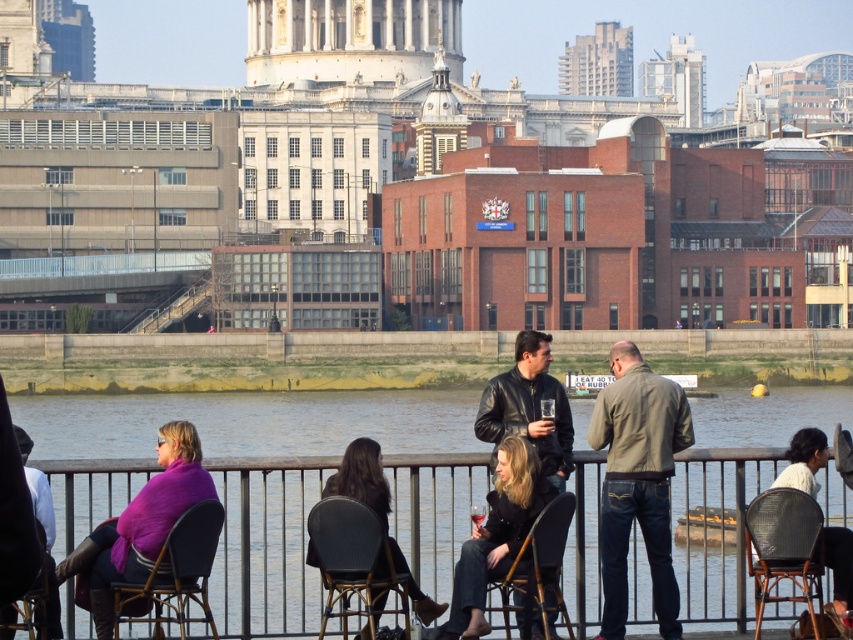
Is wooden chair at center behind dark purple sweater at lower left?

Yes.

Does wooden chair at center have a greater width compared to dark purple sweater at lower left?

In fact, wooden chair at center might be narrower than dark purple sweater at lower left.

Between point (506, 614) and point (49, 632), which one is positioned in front?

Point (49, 632) is in front.

Locate an element on the screen. wooden chair at center is located at coordinates (541, 563).

Who is shorter, matte brown jacket at center or dark purple sweater at lower left?

Standing shorter between the two is dark purple sweater at lower left.

Which is in front, point (660, 625) or point (25, 474)?

Point (25, 474)

Between point (630, 413) and point (28, 468), which one is positioned behind?

The point (630, 413) is behind.

What are the coordinates of `matte brown jacket at center` in the screenshot? It's located at (637, 483).

Does wooden chair at center come in front of white fabric jacket at lower right?

Yes, wooden chair at center is in front of white fabric jacket at lower right.

Between point (564, 512) and point (822, 436), which one is positioned in front?

Positioned in front is point (564, 512).

Find the location of `wooden chair at center`. wooden chair at center is located at coordinates (541, 563).